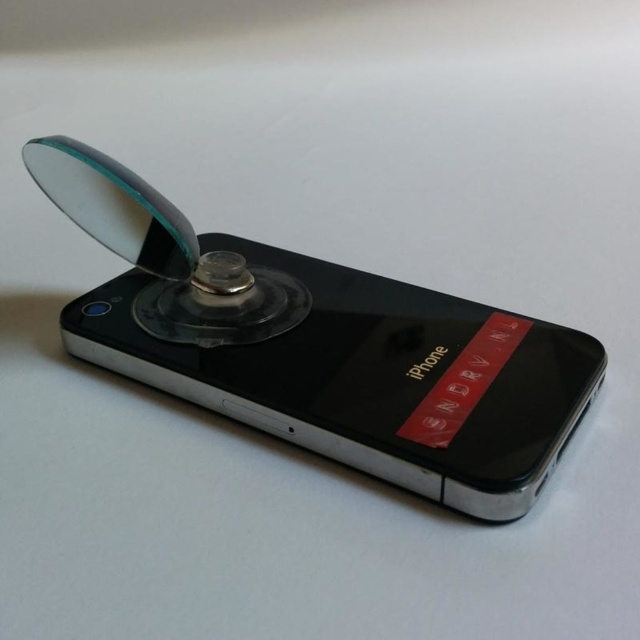
Is black glossy iphone at center taller than transparent plastic magnifying glass at upper center?

Correct, black glossy iphone at center is much taller as transparent plastic magnifying glass at upper center.

Is point (544, 412) in front of point (86, 216)?

Yes, it is.

The image size is (640, 640). I want to click on black glossy iphone at center, so click(358, 371).